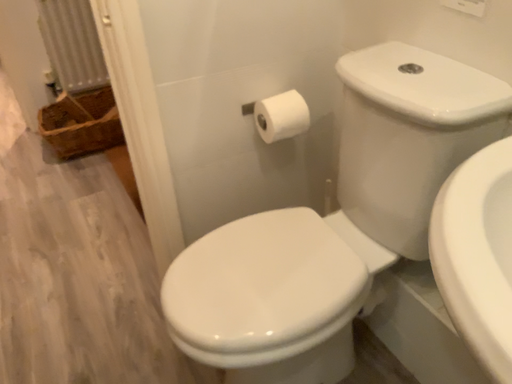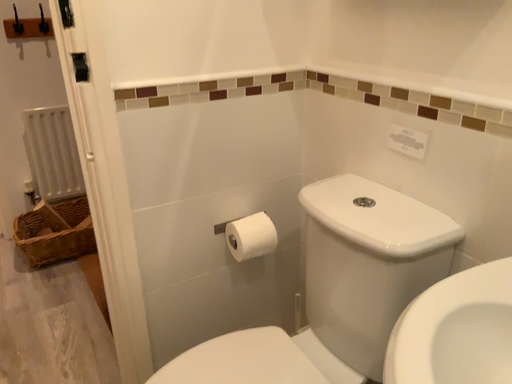
Question: How did the camera likely rotate when shooting the video?

Choices:
 (A) rotated downward
 (B) rotated upward

Answer: (B)